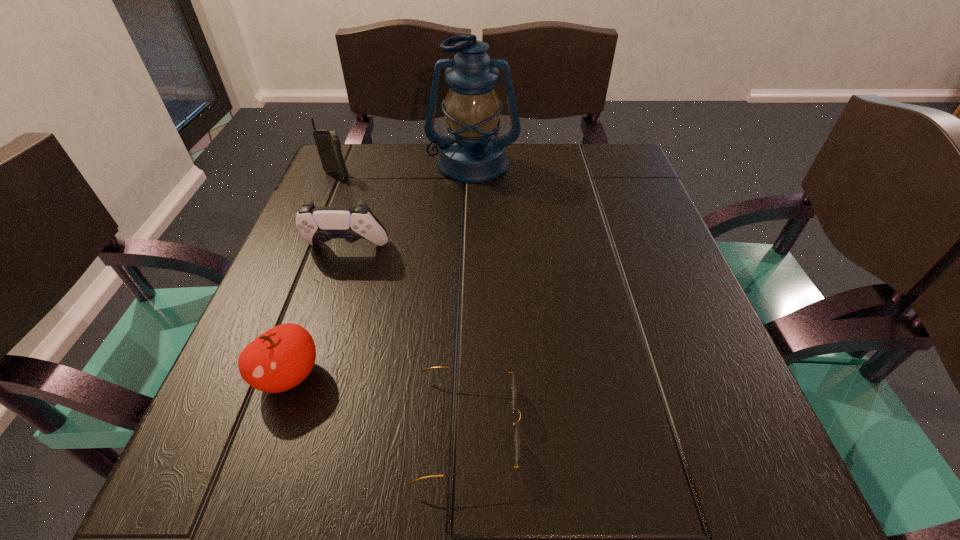
Locate an element on the screen. The image size is (960, 540). vacant region between the tallest object and the third farthest object is located at coordinates (410, 206).

Find the location of `vacant area between the tallest object and the apple`. vacant area between the tallest object and the apple is located at coordinates (381, 270).

This screenshot has height=540, width=960. I want to click on unoccupied position between the lantern and the shortest object, so click(x=470, y=296).

You are a GUI agent. You are given a task and a screenshot of the screen. Output one action in this format:
    pyautogui.click(x=<x>, y=<y>)
    Task: Click on the free spot between the lantern and the second tallest object
    
    Given the screenshot: What is the action you would take?
    pyautogui.click(x=405, y=170)

Locate an element on the screen. This screenshot has height=540, width=960. the fourth closest object to the tallest object is located at coordinates (516, 435).

Where is `object that is the nearest to the control`? object that is the nearest to the control is located at coordinates (473, 154).